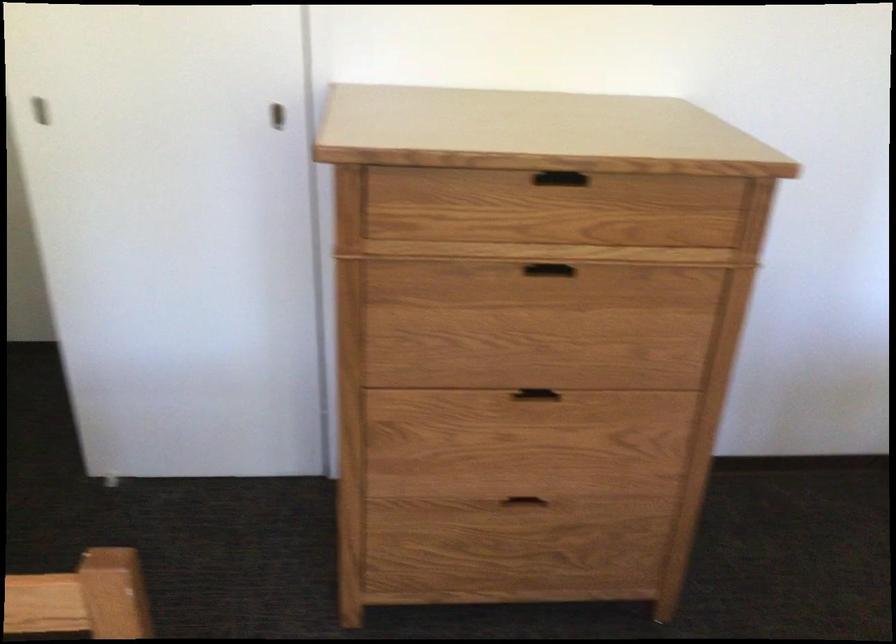
Based on the continuous images, in which direction is the camera rotating?

The camera's rotation is toward left-down.